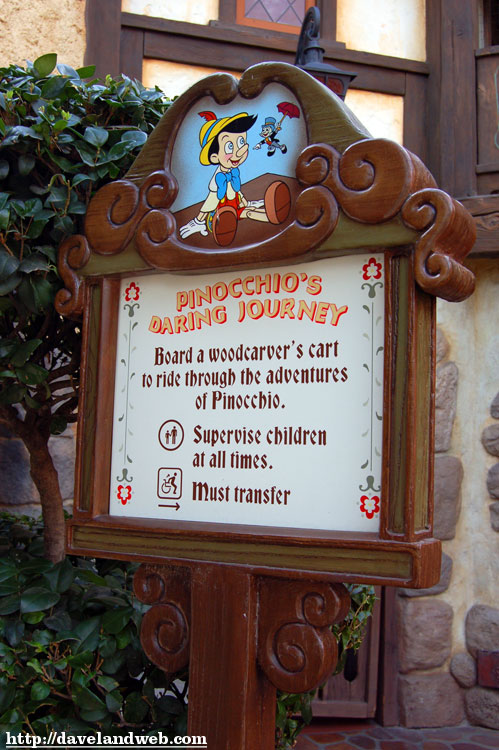
The image size is (499, 750). Find the location of `window`. window is located at coordinates (275, 10).